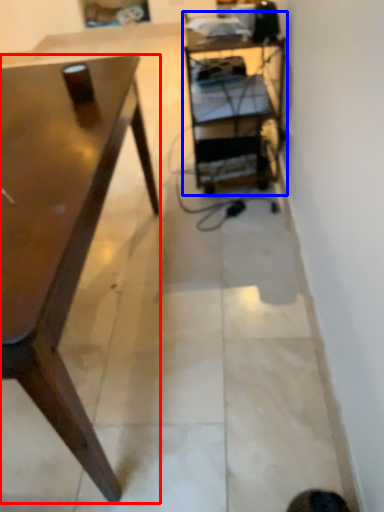
Question: Which point is closer to the camera, desk (highlighted by a red box) or shelf (highlighted by a blue box)?

Choices:
 (A) desk
 (B) shelf

Answer: (A)